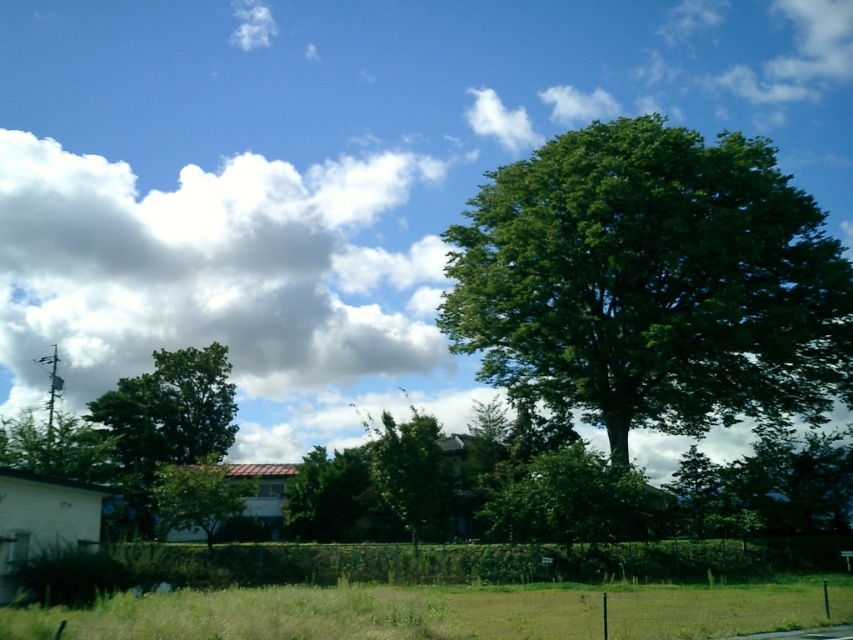
Question: Which of the following is the closest to the observer?

Choices:
 (A) (164, 428)
 (B) (737, 387)
 (C) (213, 506)

Answer: (C)

Question: Observing the image, what is the correct spatial positioning of green leafy tree at right in reference to green grass at lower center?

Choices:
 (A) right
 (B) left

Answer: (A)

Question: Does white fluffy cloud at upper left have a smaller size compared to green leafy tree at right?

Choices:
 (A) yes
 (B) no

Answer: (B)

Question: Which point is farther from the camera taking this photo?

Choices:
 (A) (140, 529)
 (B) (759, 385)
 (C) (80, 280)

Answer: (C)

Question: Can you confirm if green leafy tree at right is positioned to the right of green grass at lower center?

Choices:
 (A) yes
 (B) no

Answer: (A)

Question: Which point is farther to the camera?

Choices:
 (A) green grass at lower center
 (B) green leafy tree at right
 (C) green leafy tree at left
 (D) green leafy tree at lower left

Answer: (B)